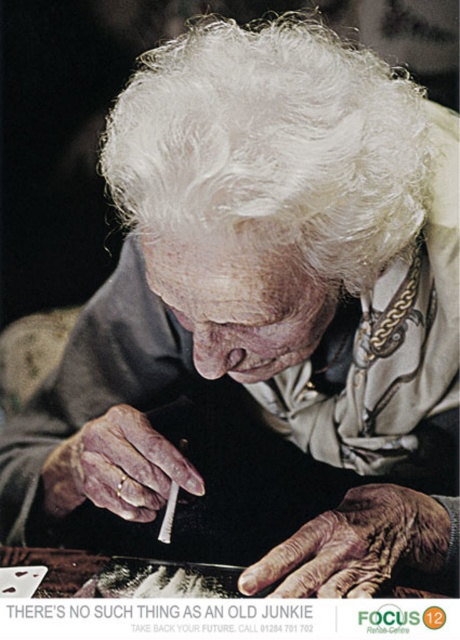
Does white fluffy hair at upper center appear on the left side of dry wrinkled hand at lower center?

Indeed, white fluffy hair at upper center is positioned on the left side of dry wrinkled hand at lower center.

Does white fluffy hair at upper center have a greater height compared to dry wrinkled hand at lower center?

Yes, white fluffy hair at upper center is taller than dry wrinkled hand at lower center.

You are a GUI agent. You are given a task and a screenshot of the screen. Output one action in this format:
    pyautogui.click(x=<x>, y=<y>)
    Task: Click on the white fluffy hair at upper center
    Image resolution: width=460 pixels, height=640 pixels.
    Given the screenshot: What is the action you would take?
    pyautogui.click(x=270, y=148)

Identify the location of white fluffy hair at upper center. (270, 148).

Between white fluffy hair at upper center and white leather cigarette at lower left, which one has less height?

white leather cigarette at lower left is shorter.

Is white fluffy hair at upper center to the right of white leather cigarette at lower left from the viewer's perspective?

Indeed, white fluffy hair at upper center is positioned on the right side of white leather cigarette at lower left.

Between point (403, 148) and point (108, 477), which one is positioned in front?

Point (403, 148) is in front.

The height and width of the screenshot is (640, 460). In order to click on white fluffy hair at upper center in this screenshot , I will do `click(270, 148)`.

Is white fluffy hair at upper center wider than white matte cigarette at center?

Correct, the width of white fluffy hair at upper center exceeds that of white matte cigarette at center.

Is white fluffy hair at upper center shorter than white matte cigarette at center?

No.

Does point (236, 144) come in front of point (164, 541)?

Yes, point (236, 144) is closer to viewer.

Find the location of a particular element. white fluffy hair at upper center is located at coordinates (270, 148).